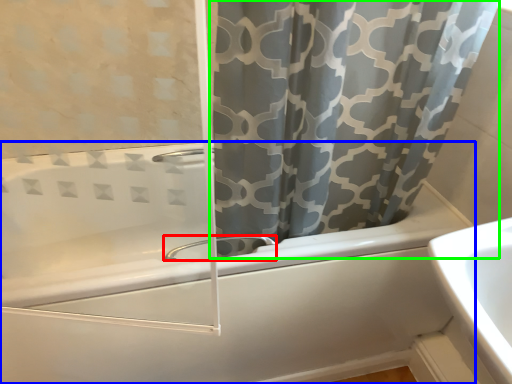
Question: Which is nearer to the tap (highlighted by a red box)? bathtub (highlighted by a blue box) or curtain (highlighted by a green box).

Choices:
 (A) bathtub
 (B) curtain

Answer: (A)